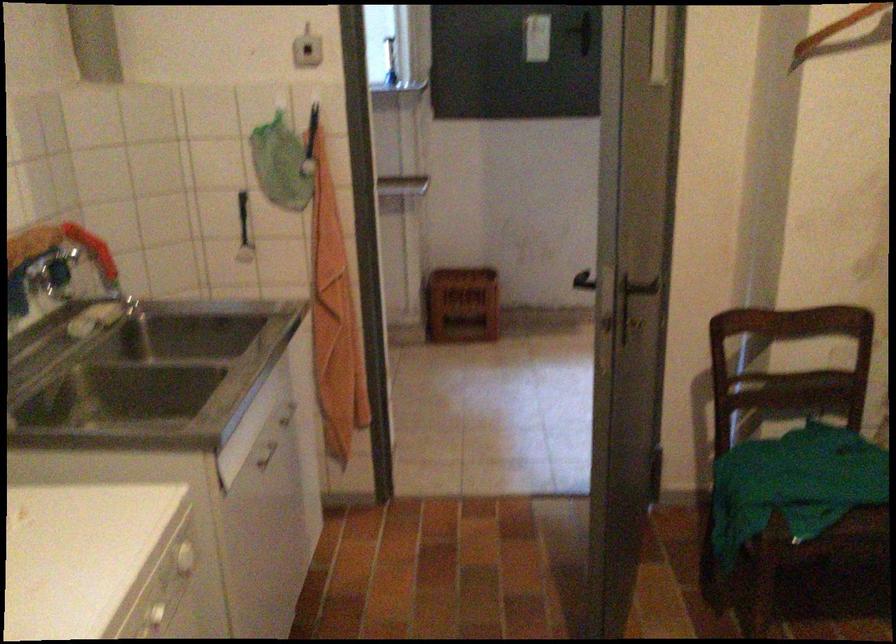
What do you see at coordinates (307, 51) in the screenshot? I see `the white wall switch` at bounding box center [307, 51].